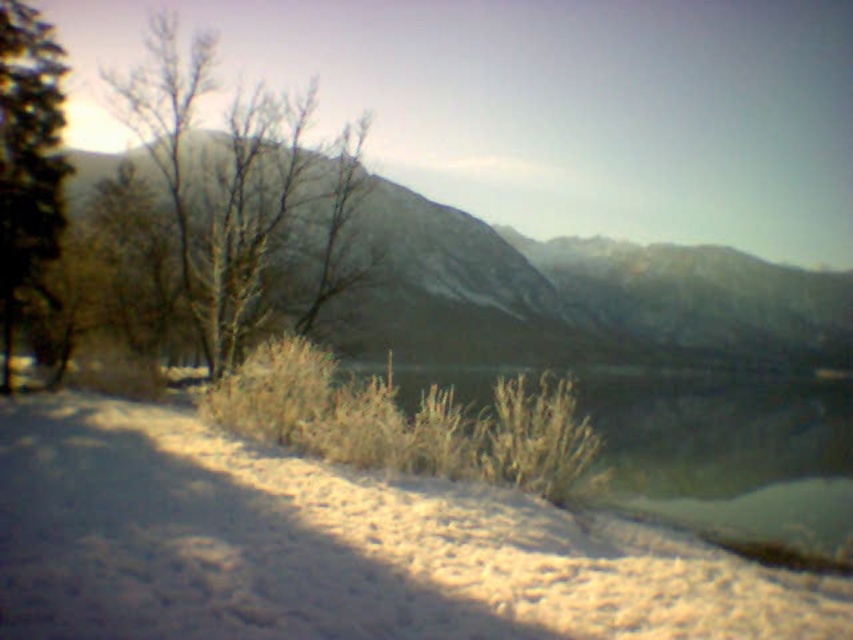
Between smooth gray rock at center and clear water at lower center, which one has more height?

Standing taller between the two is smooth gray rock at center.

Does smooth gray rock at center appear on the right side of clear water at lower center?

Correct, you'll find smooth gray rock at center to the right of clear water at lower center.

Describe the element at coordinates (602, 288) in the screenshot. This screenshot has width=853, height=640. I see `smooth gray rock at center` at that location.

You are a GUI agent. You are given a task and a screenshot of the screen. Output one action in this format:
    pyautogui.click(x=<x>, y=<y>)
    Task: Click on the smooth gray rock at center
    
    Given the screenshot: What is the action you would take?
    pyautogui.click(x=602, y=288)

Looking at this image, does white fluffy snow at lower center appear on the left side of green matte tree at left?

Incorrect, white fluffy snow at lower center is not on the left side of green matte tree at left.

Does point (712, 557) lie in front of point (4, 38)?

Yes, it is.

Who is more distant from viewer, (479,579) or (42,49)?

Point (42,49)

Identify the location of white fluffy snow at lower center. The height and width of the screenshot is (640, 853). (335, 548).

In the scene shown: Who is shorter, clear water at lower center or bare branches at center?

clear water at lower center is shorter.

Find the location of a particular element. This screenshot has width=853, height=640. clear water at lower center is located at coordinates (728, 458).